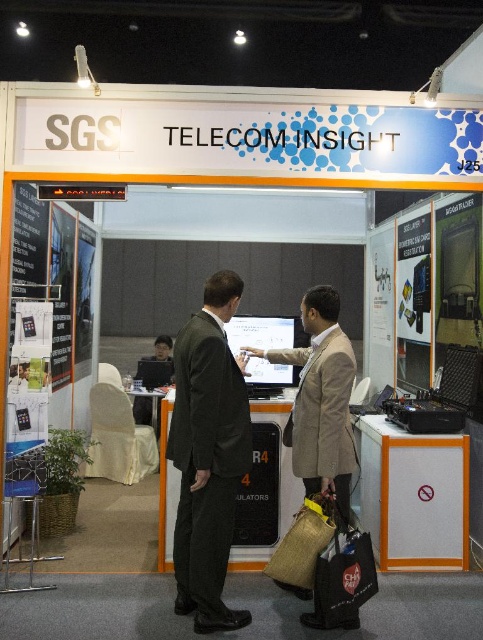
You are a photographer at the trade show and need to capture a photo of the dark green fabric business suit at center and the orange plastic cabinet at lower right. Based on their positions, which object should you focus on first to ensure both are in frame without moving the camera?

The dark green fabric business suit at center is above the orange plastic cabinet at lower right, so you should focus on the orange plastic cabinet at lower right first to ensure both are in frame without moving the camera.